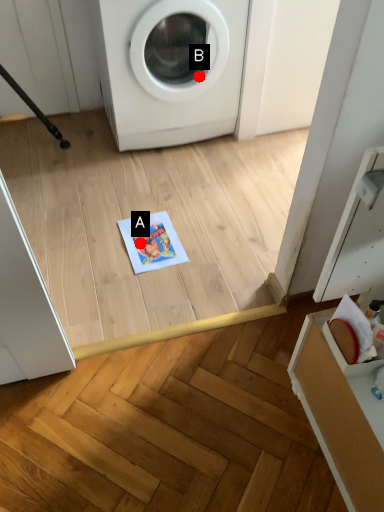
Question: Two points are circled on the image, labeled by A and B beside each circle. Which point appears closest to the camera in this image?

Choices:
 (A) A is closer
 (B) B is closer

Answer: (A)